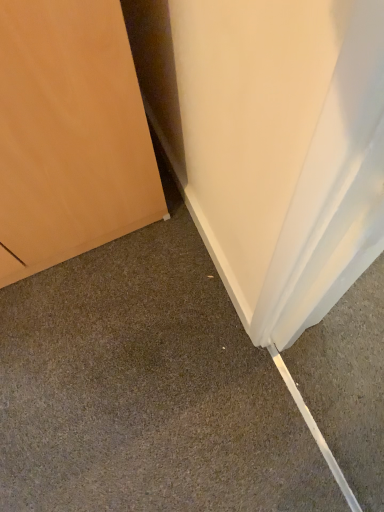
Question: Should I look upward or downward to see matte wood door at lower left?

Choices:
 (A) down
 (B) up

Answer: (A)